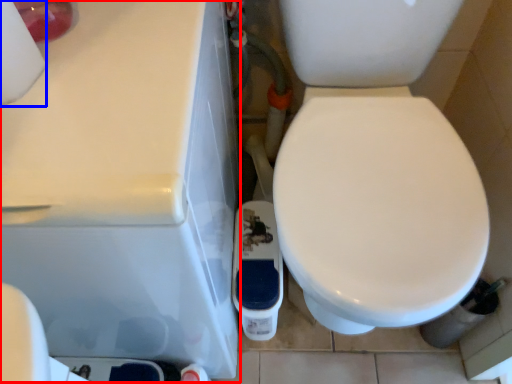
Question: Among these objects, which one is farthest to the camera, porcelain (highlighted by a red box) or toilet paper (highlighted by a blue box)?

Choices:
 (A) porcelain
 (B) toilet paper

Answer: (A)